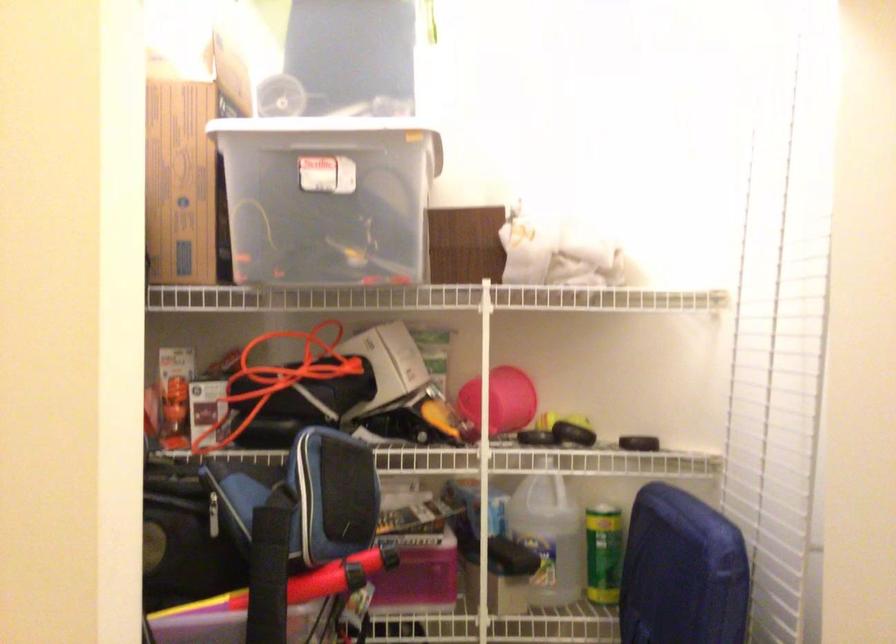
Image resolution: width=896 pixels, height=644 pixels. What do you see at coordinates (548, 536) in the screenshot?
I see `the clear jug handle` at bounding box center [548, 536].